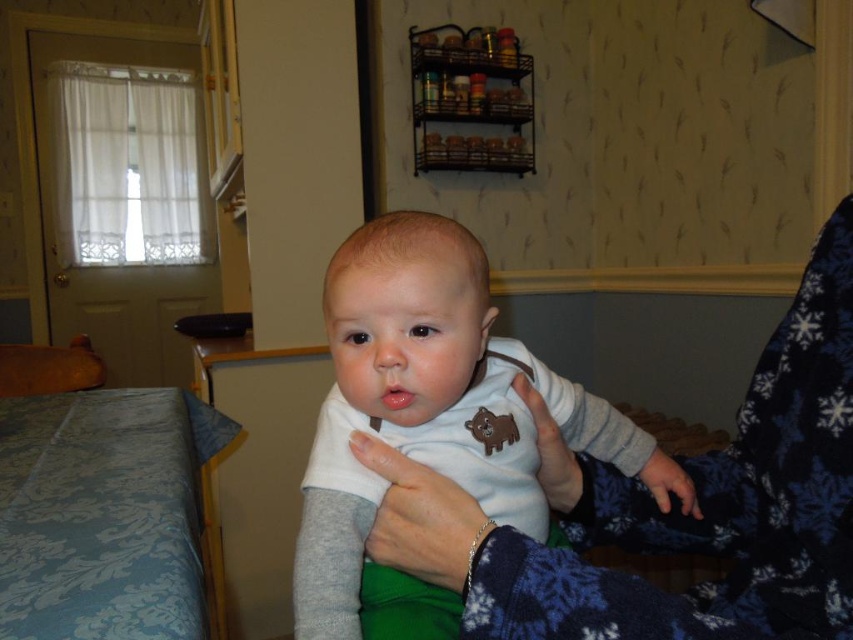
Does point (448, 573) come behind point (91, 352)?

No, (448, 573) is closer to viewer.

Does white fabric at center appear on the left side of blue damask fabric bed at lower left?

Incorrect, white fabric at center is not on the left side of blue damask fabric bed at lower left.

Who is more forward, (363, 456) or (28, 365)?

Point (363, 456)

Identify the location of white fabric at center. The height and width of the screenshot is (640, 853). (421, 518).

Can you confirm if white fabric at center is positioned to the right of soft blue fabric hand at lower right?

Incorrect, white fabric at center is not on the right side of soft blue fabric hand at lower right.

Between point (399, 484) and point (683, 472), which one is positioned in front?

Positioned in front is point (399, 484).

Who is more distant from viewer, [482,516] or [654,449]?

The point [654,449] is more distant.

This screenshot has height=640, width=853. I want to click on white fabric at center, so click(x=421, y=518).

From the picture: Does blue damask fabric bed at lower left have a larger size compared to soft blue fabric hand at lower right?

Correct, blue damask fabric bed at lower left is larger in size than soft blue fabric hand at lower right.

Who is higher up, blue damask fabric bed at lower left or soft blue fabric hand at lower right?

soft blue fabric hand at lower right is higher up.

Does point (1, 372) lie behind point (656, 461)?

Yes, it is.

Locate an element on the screen. blue damask fabric bed at lower left is located at coordinates (49, 369).